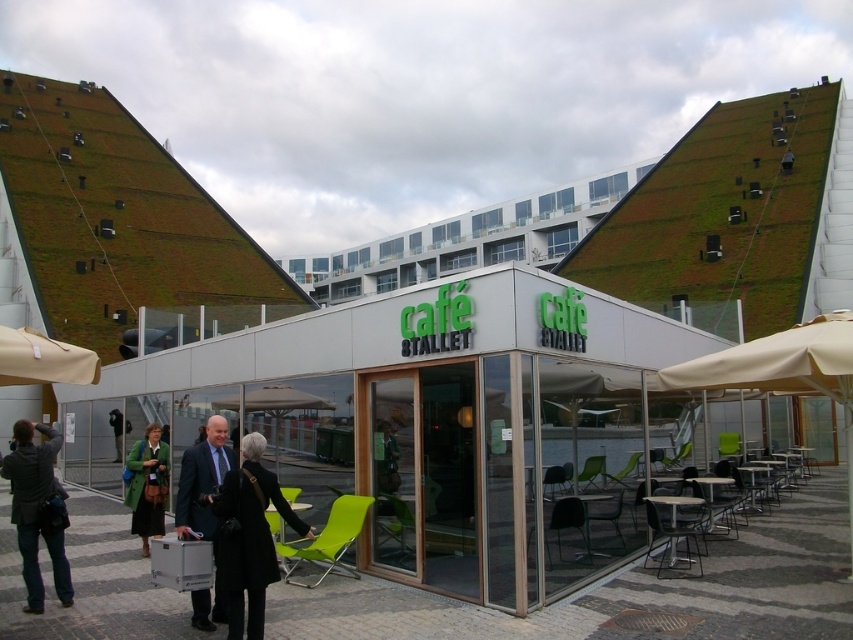
Question: Can you confirm if white glass cafe at center is positioned to the left of green plastic chair at lower right?

Choices:
 (A) no
 (B) yes

Answer: (B)

Question: Considering the real-world distances, which object is farthest from the black plastic chair at lower center?

Choices:
 (A) matte black suit at center
 (B) white glass cafe at center
 (C) dark gray jacket at lower left

Answer: (C)

Question: Among these objects, which one is farthest from the camera?

Choices:
 (A) green fabric chair at center
 (B) black leather jacket at center
 (C) beige fabric umbrella at left
 (D) black plastic chair at lower center

Answer: (A)

Question: From the image, what is the correct spatial relationship of white glass cafe at center in relation to green plastic chair at lower right?

Choices:
 (A) below
 (B) above

Answer: (B)

Question: Estimate the real-world distances between objects in this image. Which object is farther from the green plastic chair at lower center?

Choices:
 (A) black leather jacket at center
 (B) green plastic chair at lower right
 (C) black mesh chair at lower center

Answer: (A)

Question: Is green fabric coat at center positioned behind black plastic chair at lower center?

Choices:
 (A) no
 (B) yes

Answer: (B)